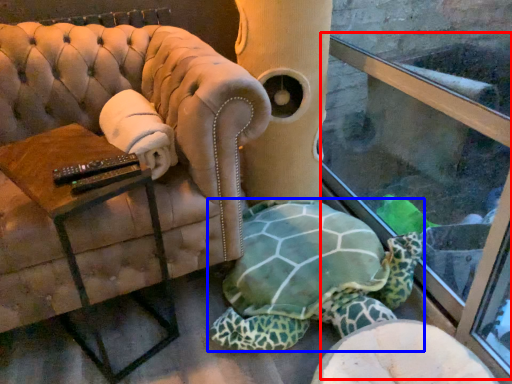
Question: Which object appears closest to the camera in this image, shop window (highlighted by a red box) or tortoise (highlighted by a blue box)?

Choices:
 (A) shop window
 (B) tortoise

Answer: (A)